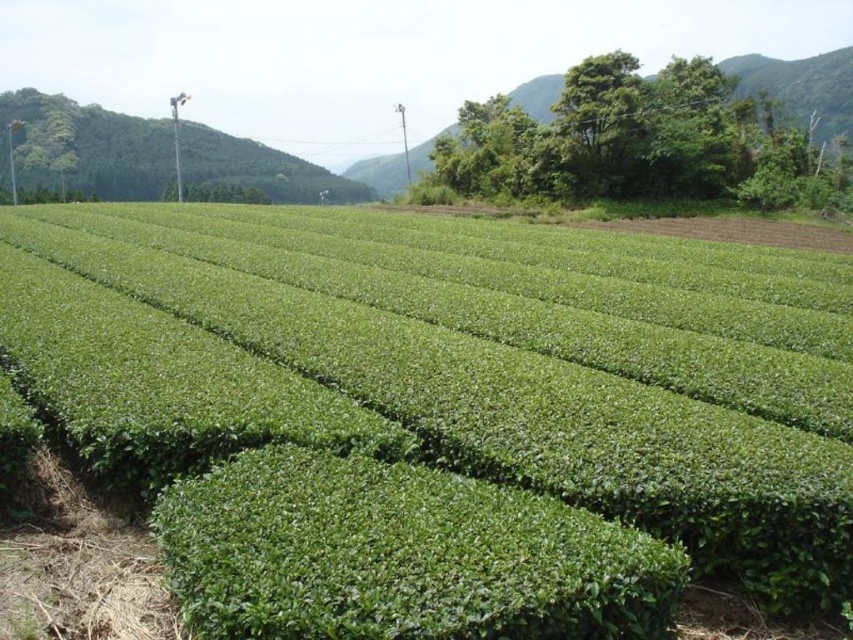
You are a farmer planning to plant new tea bushes in the green leafy field at center. You notice the green leafy hillside at upper right. Which direction should you face to ensure the new plants receive maximum sunlight? Consider their positions relative to each other.

The green leafy field at center is positioned under the green leafy hillside at upper right. Since the hillside is above the field, facing away from the hillside towards the opposite direction would allow the new tea bushes to receive maximum sunlight, as the hillside might block sunlight if faced towards it.

You are a drone operator tasked with capturing aerial footage of the green leafy field at center. The field is positioned at coordinates 0.680, 0.502. If you want to ensure the entire field is in frame, which direction should you adjust your drone to align with the field?

The green leafy field at center is located at point (427, 435), so you should adjust the drone to face directly towards those coordinates to ensure the entire field is centered in the frame.

You are a farmer checking the growth of your crops. You notice the green leafy field at center and the green leafy hillside at upper right. Which of these two has a greater height?

The green leafy hillside at upper right is taller than the green leafy field at center.